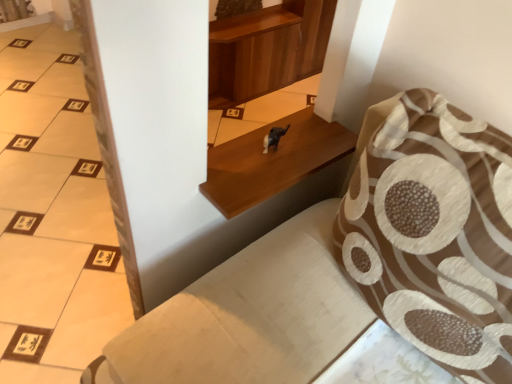
What do you see at coordinates (435, 234) in the screenshot? The image size is (512, 384). I see `brown textured pillow at upper right` at bounding box center [435, 234].

From the picture: In order to face brown textured pillow at upper right, should I rotate leftwards or rightwards?

It's best to rotate right around 24.702 degrees.

Measure the distance between wooden shelf at center and camera.

The distance of wooden shelf at center from camera is 90.62 centimeters.

This screenshot has width=512, height=384. What do you see at coordinates (272, 161) in the screenshot? I see `wooden shelf at center` at bounding box center [272, 161].

You are a GUI agent. You are given a task and a screenshot of the screen. Output one action in this format:
    pyautogui.click(x=<x>, y=<y>)
    Task: Click on the shiny black dog at center
    The height and width of the screenshot is (384, 512).
    Given the screenshot: What is the action you would take?
    pyautogui.click(x=274, y=138)

Is shiny black dog at center a part of brown textured pillow at upper right?

No, shiny black dog at center is located outside of brown textured pillow at upper right.

Does point (462, 123) come closer to viewer compared to point (272, 133)?

Yes, point (462, 123) is closer to viewer.

What's the angular difference between brown textured pillow at upper right and shiny black dog at center's facing directions?

91 degrees.

In the scene shown: Considering the positions of objects brown textured pillow at upper right and shiny black dog at center in the image provided, who is more to the right, brown textured pillow at upper right or shiny black dog at center?

Positioned to the right is brown textured pillow at upper right.

Is shiny black dog at center in contact with wooden shelf at center?

shiny black dog at center and wooden shelf at center are not in contact.

Between shiny black dog at center and wooden shelf at center, which one has more height?

Standing taller between the two is shiny black dog at center.

Would you say shiny black dog at center is outside wooden shelf at center?

That's correct, shiny black dog at center is outside of wooden shelf at center.

Which is more distant, (267, 138) or (269, 180)?

The point (267, 138) is farther from the camera.

Based on the photo, measure the distance from wooden shelf at center to shiny black dog at center.

wooden shelf at center and shiny black dog at center are 4.08 inches apart from each other.

Do you think wooden shelf at center is within shiny black dog at center, or outside of it?

wooden shelf at center cannot be found inside shiny black dog at center.

From a real-world perspective, is wooden shelf at center over shiny black dog at center?

No.

Based on the photo, which object is positioned more to the left, wooden shelf at center or shiny black dog at center?

shiny black dog at center is more to the left.

From a real-world perspective, which object rests below the other?

shiny black dog at center.

Is the surface of shiny black dog at center in direct contact with brown textured pillow at upper right?

No.

Could brown textured pillow at upper right be considered to be inside shiny black dog at center?

Definitely not — brown textured pillow at upper right is not inside shiny black dog at center.

Is wooden shelf at center not within brown textured pillow at upper right?

That's correct, wooden shelf at center is outside of brown textured pillow at upper right.

Looking at the image, does wooden shelf at center seem bigger or smaller compared to brown textured pillow at upper right?

Clearly, wooden shelf at center is smaller in size than brown textured pillow at upper right.

Is wooden shelf at center aimed at brown textured pillow at upper right?

Yes, wooden shelf at center is aimed at brown textured pillow at upper right.

Is there a large distance between brown textured pillow at upper right and wooden shelf at center?

Actually, brown textured pillow at upper right and wooden shelf at center are a little close together.

Does brown textured pillow at upper right have a lesser width compared to wooden shelf at center?

No, brown textured pillow at upper right is not thinner than wooden shelf at center.

Considering the relative sizes of brown textured pillow at upper right and wooden shelf at center in the image provided, is brown textured pillow at upper right smaller than wooden shelf at center?

Actually, brown textured pillow at upper right might be larger than wooden shelf at center.

Is point (511, 295) farther from viewer compared to point (214, 165)?

That is False.

Where is `throw pillow below the shiny black dog at center (from the image's perspective)`? throw pillow below the shiny black dog at center (from the image's perspective) is located at coordinates (435, 234).

At what (x,y) coordinates should I click in order to perform the action: click on animal that is above the wooden shelf at center (from the image's perspective). Please return your answer as a coordinate pair (x, y). Looking at the image, I should click on (274, 138).

Looking at this image, which object lies nearer to the anchor point shiny black dog at center, wooden shelf at center or brown textured pillow at upper right?

wooden shelf at center lies closer to shiny black dog at center than the other object.

In the scene shown: Based on their spatial positions, is brown textured pillow at upper right or shiny black dog at center closer to wooden shelf at center?

Based on the image, shiny black dog at center appears to be nearer to wooden shelf at center.

Looking at the image, which one is located further to brown textured pillow at upper right, wooden shelf at center or shiny black dog at center?

shiny black dog at center is further to brown textured pillow at upper right.

Which object lies nearer to the anchor point shiny black dog at center, brown textured pillow at upper right or wooden shelf at center?

Based on the image, wooden shelf at center appears to be nearer to shiny black dog at center.

Looking at the image, which one is located further to wooden shelf at center, shiny black dog at center or brown textured pillow at upper right?

Among the two, brown textured pillow at upper right is located further to wooden shelf at center.

Considering their positions, is shiny black dog at center positioned further to brown textured pillow at upper right than wooden shelf at center?

Based on the image, shiny black dog at center appears to be further to brown textured pillow at upper right.

I want to click on furniture positioned between brown textured pillow at upper right and shiny black dog at center from near to far, so click(x=272, y=161).